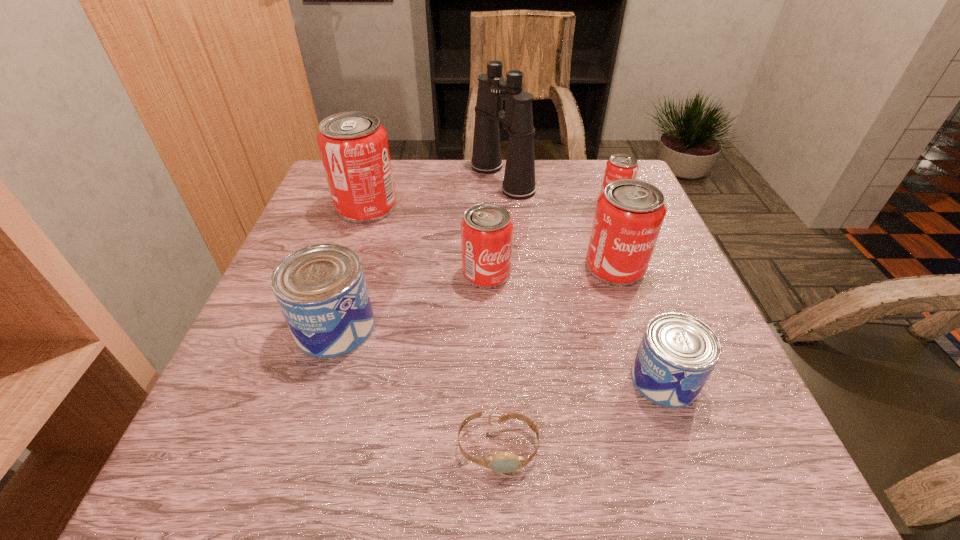
Identify the location of the tallest object. The height and width of the screenshot is (540, 960). (519, 183).

Locate an element on the screen. the seventh shortest object is located at coordinates (353, 146).

Where is `the biggest red can`? Image resolution: width=960 pixels, height=540 pixels. the biggest red can is located at coordinates (353, 146).

This screenshot has width=960, height=540. What are the coordinates of `the second tallest can` in the screenshot? It's located at (629, 214).

Find the location of a particular element. the third tallest object is located at coordinates (629, 214).

Identify the location of the second smallest red can. (486, 229).

The height and width of the screenshot is (540, 960). In order to click on the fourth can from right to left in this screenshot , I will do `click(486, 229)`.

You are a GUI agent. You are given a task and a screenshot of the screen. Output one action in this format:
    pyautogui.click(x=<x>, y=<y>)
    Task: Click on the left blue can
    The image size is (960, 540).
    Given the screenshot: What is the action you would take?
    pyautogui.click(x=321, y=289)

Identify the location of the smallest red can. (620, 166).

Locate an element on the screen. The width and height of the screenshot is (960, 540). the right blue can is located at coordinates (678, 352).